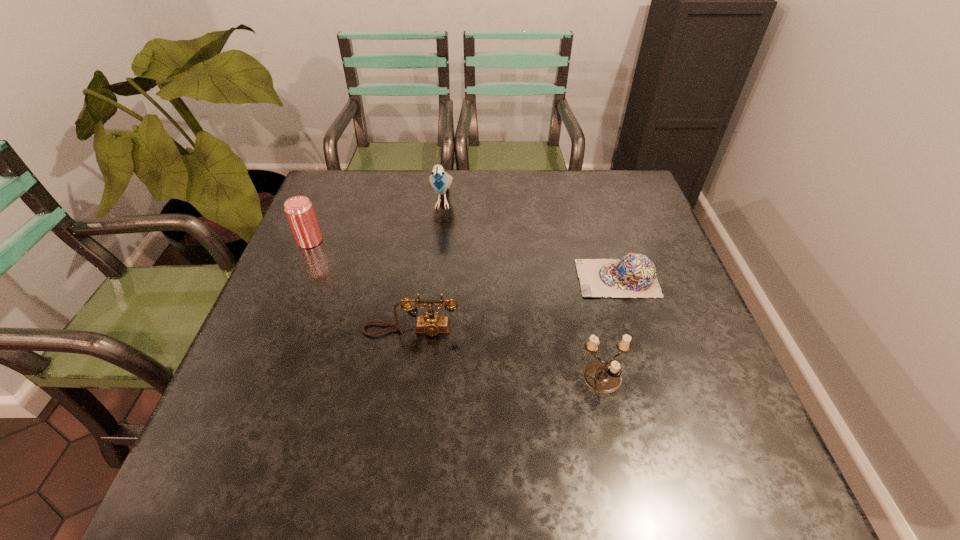
What are the coordinates of `the tallest object` in the screenshot? It's located at (441, 181).

Locate an element on the screen. This screenshot has height=540, width=960. bird is located at coordinates (441, 181).

Find the location of a particular element. This screenshot has width=960, height=540. beer can is located at coordinates (299, 210).

Where is `the leftmost object`? the leftmost object is located at coordinates (299, 210).

Identify the location of the nearest object. This screenshot has width=960, height=540. (602, 377).

Locate an element on the screen. the second nearest object is located at coordinates (432, 324).

The width and height of the screenshot is (960, 540). I want to click on the third nearest object, so click(634, 275).

The width and height of the screenshot is (960, 540). In order to click on cap in this screenshot , I will do `click(634, 275)`.

Find the location of a particular element. free space located at the face of the farthest object is located at coordinates (439, 241).

Where is `free spot located on the right of the beer can`? This screenshot has height=540, width=960. free spot located on the right of the beer can is located at coordinates (373, 241).